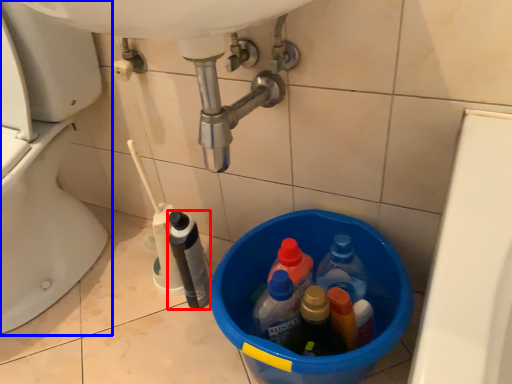
Question: Among these objects, which one is nearest to the camera, bottle (highlighted by a red box) or toilet (highlighted by a blue box)?

Choices:
 (A) bottle
 (B) toilet

Answer: (B)